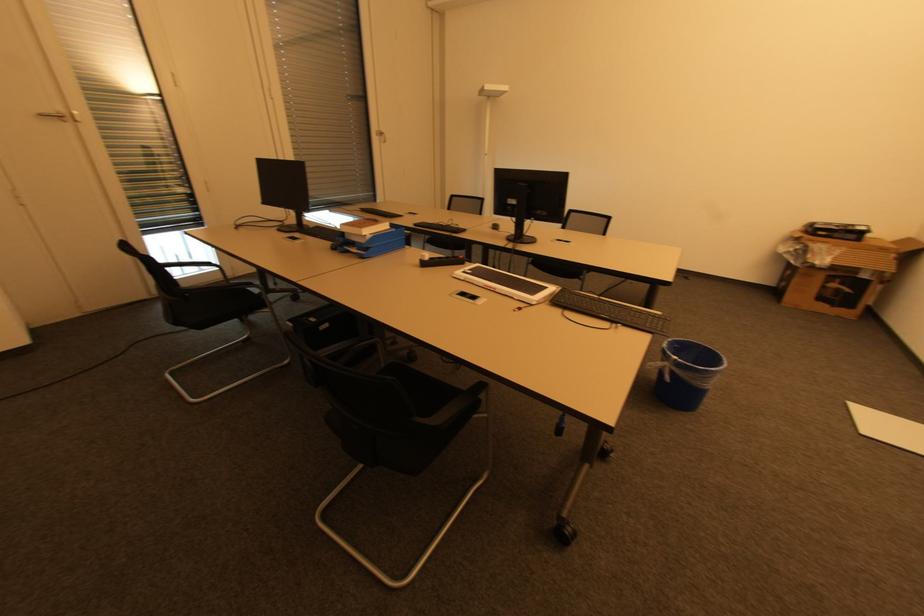
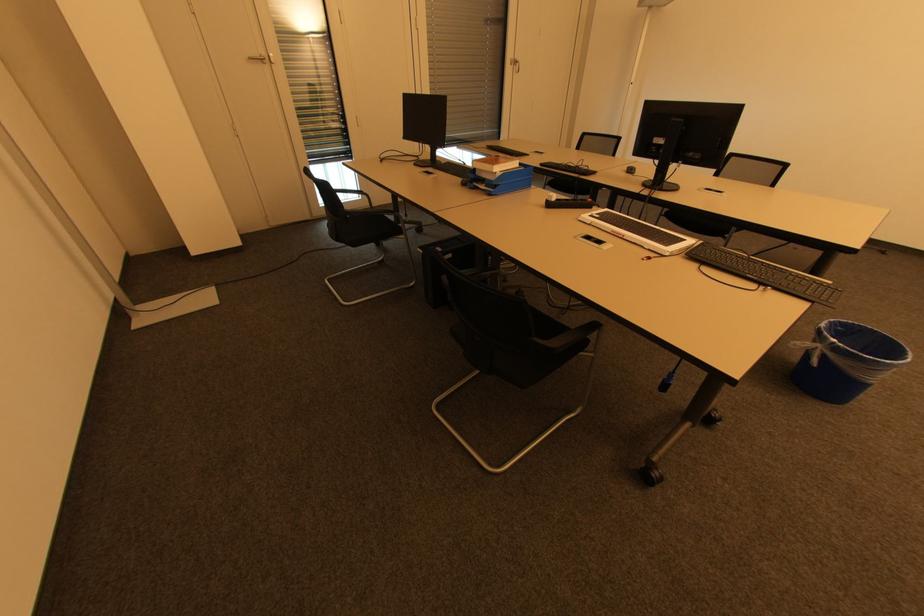
In the second image, find the point that corresponds to [499,230] in the first image.

(634, 174)